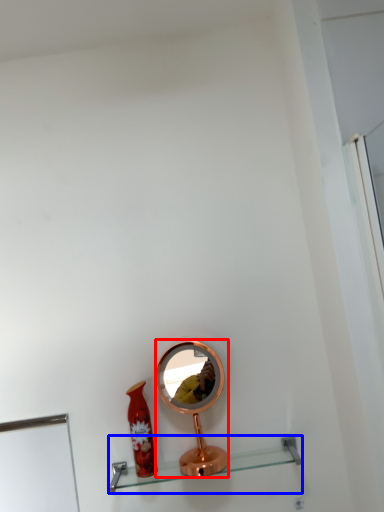
Question: Which object is closer to the camera taking this photo, mirror (highlighted by a red box) or shelf (highlighted by a blue box)?

Choices:
 (A) mirror
 (B) shelf

Answer: (B)